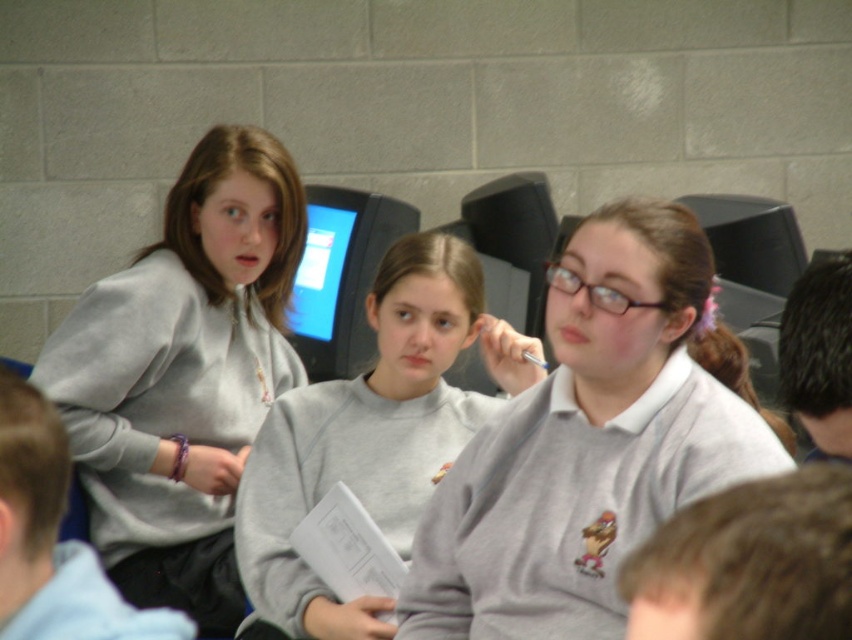
In the classroom scene with a light brick wall background, where exactly is the matte gray sweater at center located in terms of coordinates?

The matte gray sweater at center is located at point coordinates of (586, 444).

What is located at the coordinates point (749, 563) in the image?

At point (749, 563) lies brown hair at lower right.